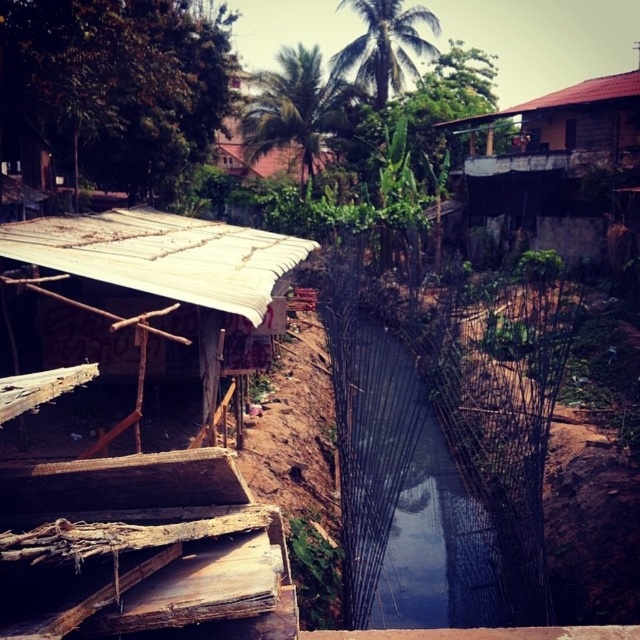
You are a delivery person trying to cross the transparent plastic water at center to reach the natural bamboo hut at left. Can you safely walk over it?

The transparent plastic water at center has a greater height compared to natural bamboo hut at left, so it is deeper and may not be safe to walk over.

You are standing in the rural area shown in the image. You see a point labeled as point (412, 492). What is located at that point?

Transparent plastic water at center is located at point (412, 492).

You are a delivery person carrying a package that requires a path clear of obstacles. You need to move from the natural bamboo hut at left to the transparent plastic water at center. Can you walk straight there without any obstacles in between?

The distance between the natural bamboo hut at left and the transparent plastic water at center is 3.52 meters. Since there are no objects mentioned between them in the scene description, you can walk straight there without obstacles.